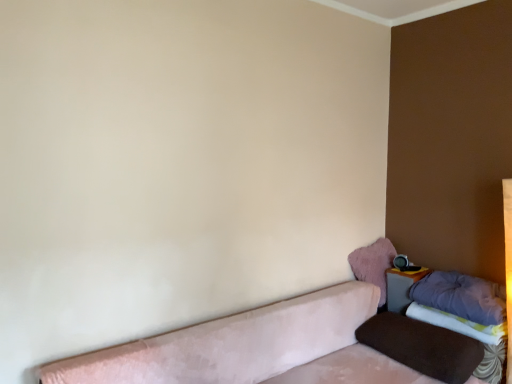
Question: From a real-world perspective, is brown velvety pillow at lower right, arranged as the 1th pillow when ordered from the bottom, located higher than purple soft pillow at right, the second pillow from the bottom?

Choices:
 (A) no
 (B) yes

Answer: (A)

Question: Considering the relative sizes of brown velvety pillow at lower right, arranged as the 1th pillow when ordered from the bottom, and purple soft pillow at right, the second pillow from the bottom, in the image provided, is brown velvety pillow at lower right, arranged as the 1th pillow when ordered from the bottom, bigger than purple soft pillow at right, the second pillow from the bottom,?

Choices:
 (A) no
 (B) yes

Answer: (B)

Question: Considering the relative sizes of brown velvety pillow at lower right, which is the 3th pillow in top-to-bottom order, and purple soft pillow at right, the second pillow from the bottom, in the image provided, is brown velvety pillow at lower right, which is the 3th pillow in top-to-bottom order, wider than purple soft pillow at right, the second pillow from the bottom,?

Choices:
 (A) no
 (B) yes

Answer: (B)

Question: Does brown velvety pillow at lower right, arranged as the 1th pillow when ordered from the bottom, lie in front of purple soft pillow at right, the second pillow from the bottom?

Choices:
 (A) no
 (B) yes

Answer: (B)

Question: Does brown velvety pillow at lower right, arranged as the 1th pillow when ordered from the bottom, appear on the right side of purple soft pillow at right, arranged as the second pillow when viewed from the top?

Choices:
 (A) yes
 (B) no

Answer: (B)

Question: Considering the positions of purple fabric sheet at lower right and matte gray table at lower right in the image, is purple fabric sheet at lower right wider or thinner than matte gray table at lower right?

Choices:
 (A) wide
 (B) thin

Answer: (A)

Question: Looking at the image, does purple fabric sheet at lower right seem bigger or smaller compared to matte gray table at lower right?

Choices:
 (A) big
 (B) small

Answer: (A)

Question: Visually, is purple fabric sheet at lower right positioned to the left or to the right of matte gray table at lower right?

Choices:
 (A) right
 (B) left

Answer: (A)

Question: From the image's perspective, is purple fabric sheet at lower right above or below matte gray table at lower right?

Choices:
 (A) above
 (B) below

Answer: (B)

Question: Considering the positions of purple fabric sheet at lower right and fuzzy pink pillow at upper right, positioned as the 3th pillow in bottom-to-top order, in the image, is purple fabric sheet at lower right wider or thinner than fuzzy pink pillow at upper right, positioned as the 3th pillow in bottom-to-top order,?

Choices:
 (A) wide
 (B) thin

Answer: (A)

Question: From a real-world perspective, is purple fabric sheet at lower right positioned above or below fuzzy pink pillow at upper right, which is counted as the 1th pillow, starting from the top?

Choices:
 (A) above
 (B) below

Answer: (B)

Question: Considering the relative positions of purple fabric sheet at lower right and fuzzy pink pillow at upper right, positioned as the 3th pillow in bottom-to-top order, in the image provided, is purple fabric sheet at lower right to the left or to the right of fuzzy pink pillow at upper right, positioned as the 3th pillow in bottom-to-top order,?

Choices:
 (A) left
 (B) right

Answer: (B)

Question: In terms of height, does purple fabric sheet at lower right look taller or shorter compared to fuzzy pink pillow at upper right, which is counted as the 1th pillow, starting from the top?

Choices:
 (A) short
 (B) tall

Answer: (A)

Question: From the image's perspective, is brown velvety pillow at lower right, arranged as the 1th pillow when ordered from the bottom, positioned above or below matte gray table at lower right?

Choices:
 (A) above
 (B) below

Answer: (B)

Question: Visually, is brown velvety pillow at lower right, which is the 3th pillow in top-to-bottom order, positioned to the left or to the right of matte gray table at lower right?

Choices:
 (A) left
 (B) right

Answer: (A)